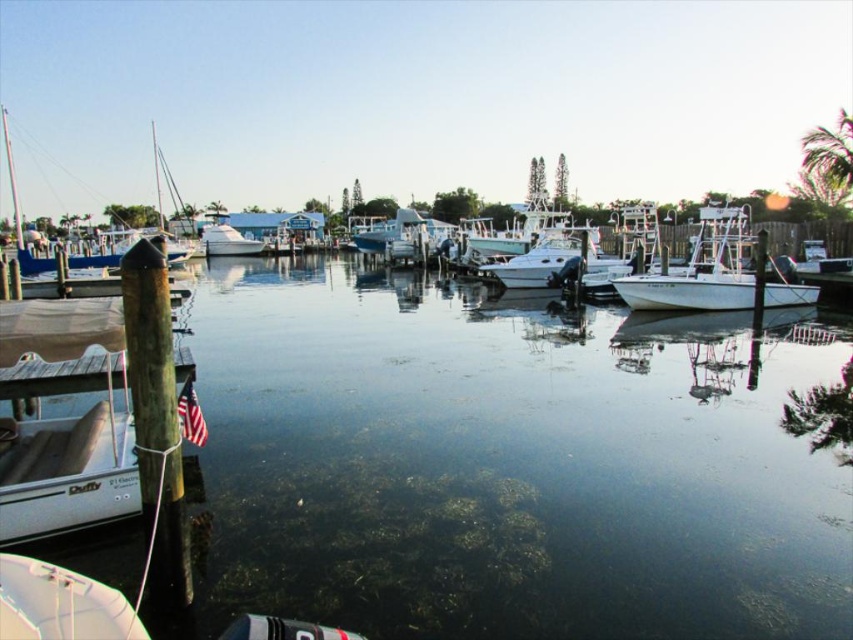
You are a boat operator who wants to navigate a new boat through the marina. You see the clear water at center and the blue matte sailboat at left. Which path would you choose to ensure your boat can pass safely?

The clear water at center has a lesser width compared to the blue matte sailboat at left, so you should choose the path near the blue matte sailboat at left since it is wider and allows for safer passage.

You are a boat operator who needs to navigate a small dinghy through the marina. The dinghy requires a channel width of at least 3 meters to pass safely. Based on the scene, can the dinghy safely pass through the area between the clear water at center and the white matte boat at center?

The clear water at center has a larger width than the white matte boat at center. However, without specific measurements provided in the scene description, it is impossible to determine if the channel width meets the dinghy requirement of 3 meters. Please consult a nautical chart or use a measuring tool for accurate dimensions.

You are standing at the edge of the marina and want to locate the clear water at center. According to the coordinates provided, where would you find it?

The clear water at center is located at the coordinates point (x=514, y=461).